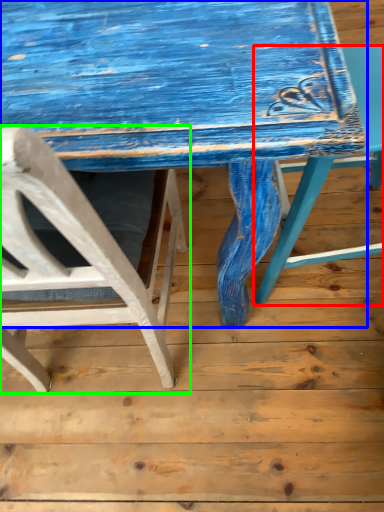
Question: Considering the real-world distances, which object is farthest from chair (highlighted by a red box)? table (highlighted by a blue box) or chair (highlighted by a green box)?

Choices:
 (A) table
 (B) chair

Answer: (B)